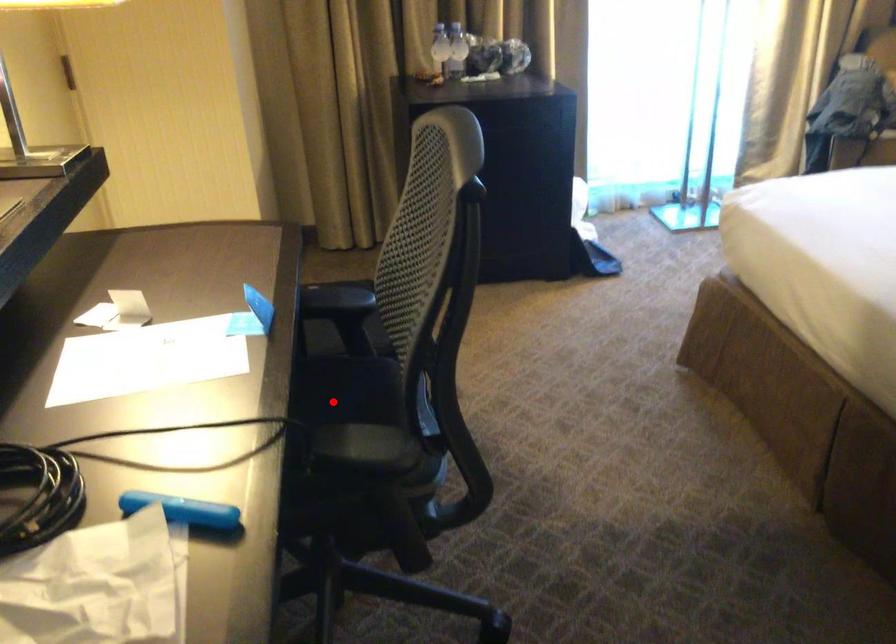
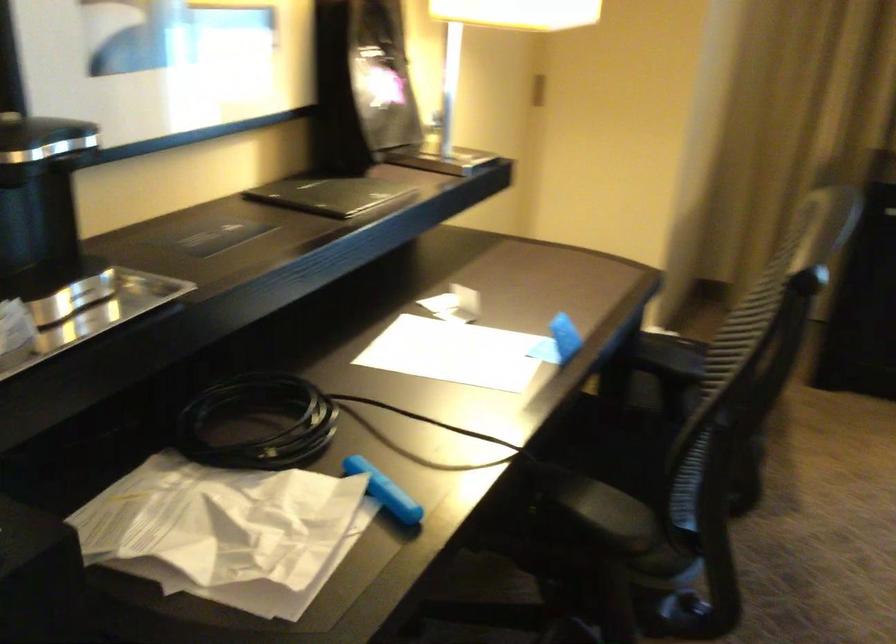
Find the pixel in the second image that matches the highlighted location in the first image.

(625, 457)